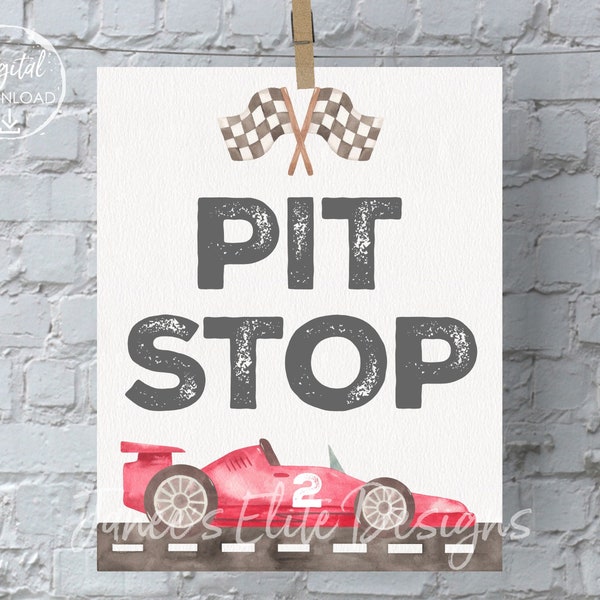
This screenshot has height=600, width=600. I want to click on brick wall, so click(55, 184).